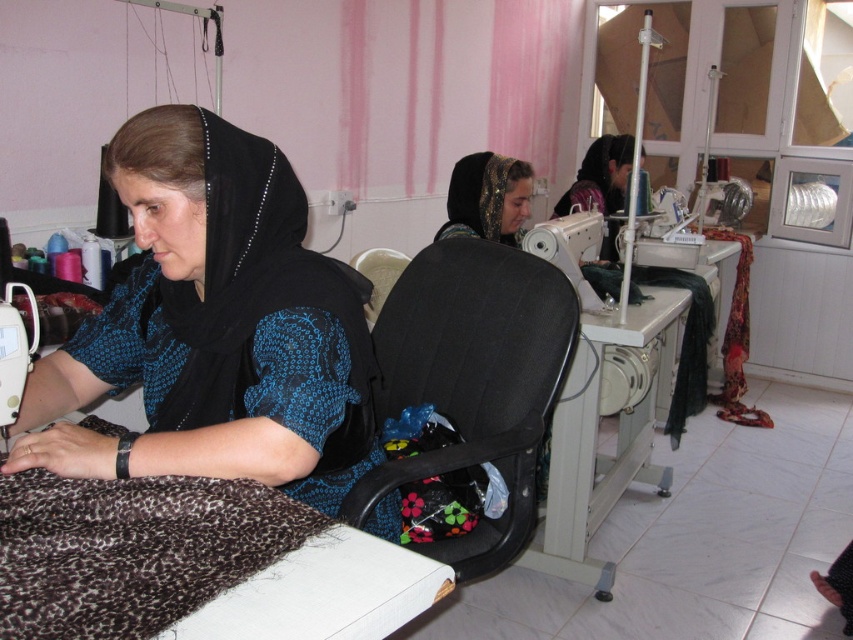
Between black lace dress at left and metallic gray sewing machine at center, which one appears on the left side from the viewer's perspective?

black lace dress at left is more to the left.

Can you confirm if black lace dress at left is positioned to the left of metallic gray sewing machine at center?

Yes, black lace dress at left is to the left of metallic gray sewing machine at center.

Which is behind, point (263, 476) or point (569, 518)?

The point (569, 518) is behind.

Where is `black lace dress at left`? black lace dress at left is located at coordinates (215, 326).

Does metallic gray sewing machine at center appear under matte black sewing machine at upper right?

Correct, metallic gray sewing machine at center is located below matte black sewing machine at upper right.

Which is behind, point (670, 385) or point (608, 196)?

The point (608, 196) is more distant.

Is point (564, 529) farther from viewer compared to point (614, 144)?

No, (564, 529) is in front of (614, 144).

Where is `metallic gray sewing machine at center`? The width and height of the screenshot is (853, 640). metallic gray sewing machine at center is located at coordinates (601, 406).

Is point (140, 145) in front of point (514, 168)?

Yes, it is in front of point (514, 168).

Is black lace dress at left above matte black headscarf at center?

Incorrect, black lace dress at left is not positioned above matte black headscarf at center.

You are a GUI agent. You are given a task and a screenshot of the screen. Output one action in this format:
    pyautogui.click(x=<x>, y=<y>)
    Task: Click on the black lace dress at left
    The image size is (853, 640).
    Given the screenshot: What is the action you would take?
    pyautogui.click(x=215, y=326)